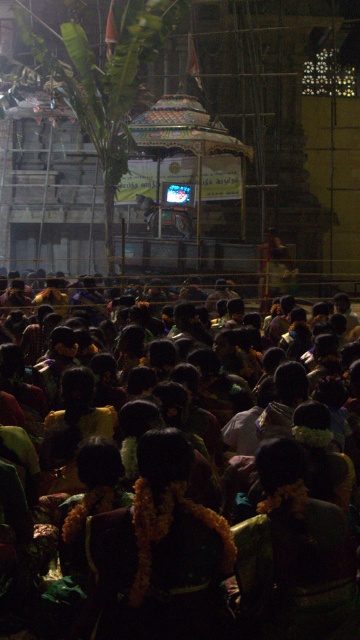
You are standing in the crowd at the event and want to take a photo of both the point at coordinates (186, 579) and the point at (146, 460). Which point should you focus on first to ensure both are in focus?

You should focus on the point at (186, 579) first because it is closer to the camera than the point at (146, 460). By focusing on the closer point, the farther point will also be within the depth of field, ensuring both are in focus.